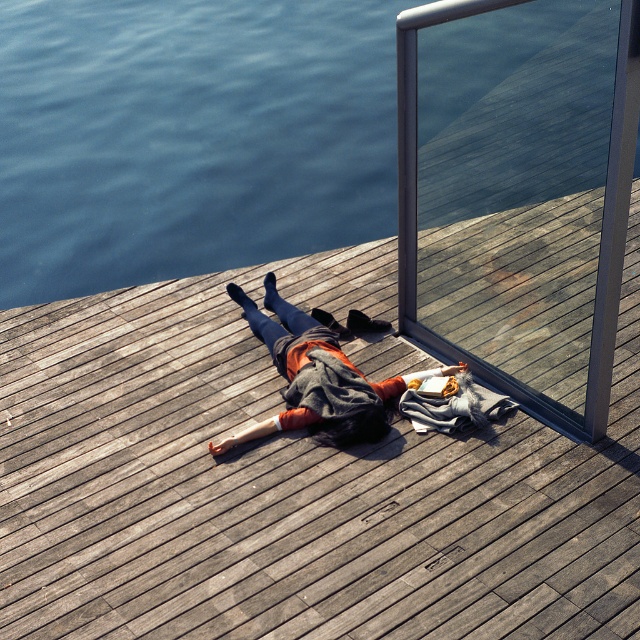
You are a photographer trying to capture the entire scene in one shot. You notice the brushed metal rail at upper right and the orange sweater at center. Which object will appear bigger in the photo?

The brushed metal rail at upper right will appear bigger in the photo because it has a larger size compared to the orange sweater at center.

You are standing on the shore and want to place a 3.5 meter long fishing rod on the wooden dock at center. Can you place the fishing rod entirely on the dock without any part hanging off?

The wooden dock at center is 3.69 meters away from the camera, but the distance does not indicate its length. Therefore, it is unclear if the dock is long enough to accommodate the 3.5 meter fishing rod. More information about the dock length is needed.

You are a photographer positioned at the camera location. You want to capture a photo where both the point at [529,305] and the point at [273,291] are in focus. Which point should be your focus priority to ensure both are sharp?

Point at [529,305] should be the focus priority because it is closer to the camera. By focusing on the closer point, the depth of field will extend to the farther point, increasing the likelihood of both being sharp.